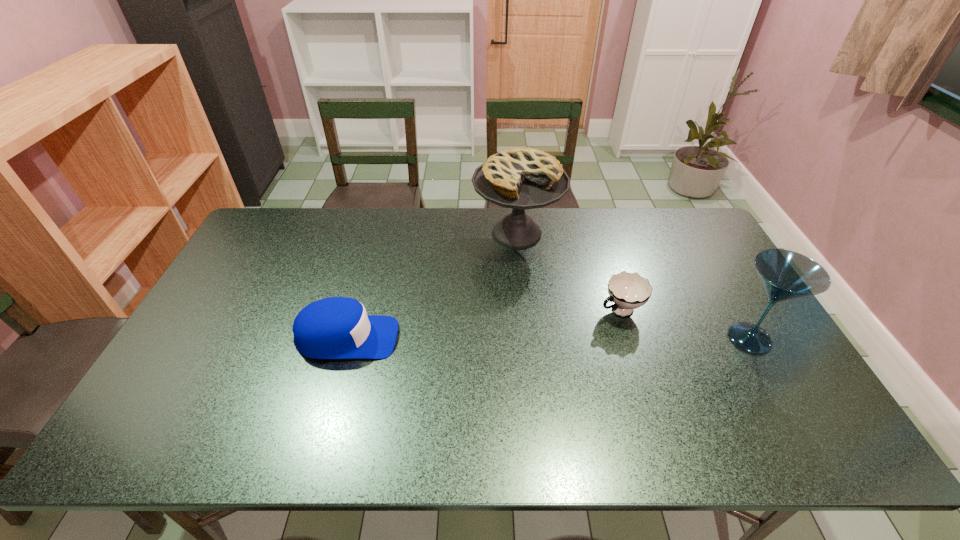
The image size is (960, 540). Find the location of `free space on the desktop that is between the baseball cap and the rightmost object and is positioned on the side of the cup with the handle`. free space on the desktop that is between the baseball cap and the rightmost object and is positioned on the side of the cup with the handle is located at coordinates [x=564, y=338].

Find the location of a particular element. free space on the desktop that is between the leftmost object and the rightmost object and is positioned on the cut side of the third object from right to left is located at coordinates (525, 338).